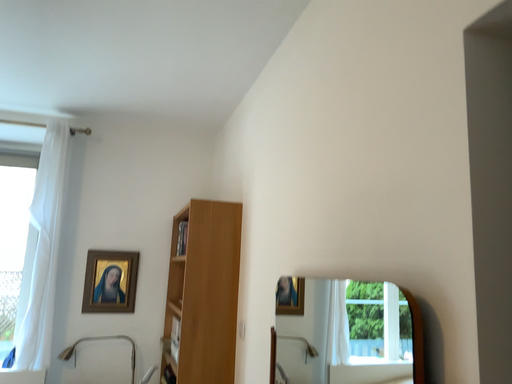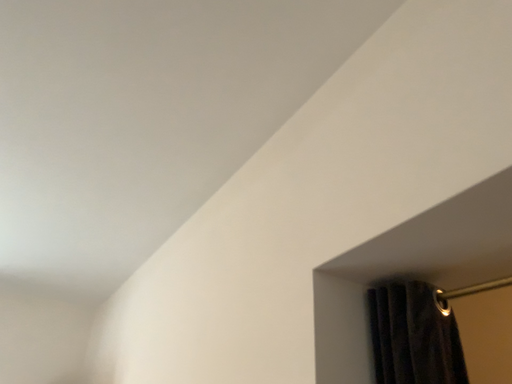
Question: How did the camera likely rotate when shooting the video?

Choices:
 (A) rotated upward
 (B) rotated downward

Answer: (A)